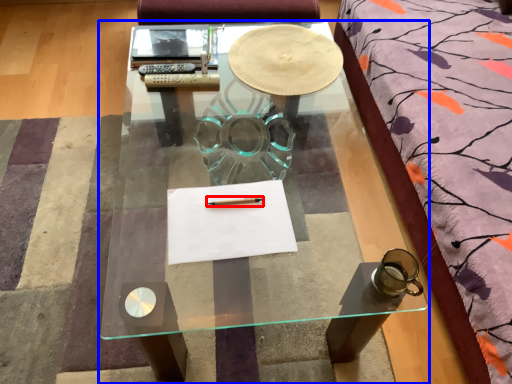
Question: Which of the following is the closest to the observer, pencil (highlighted by a red box) or coffee table (highlighted by a blue box)?

Choices:
 (A) pencil
 (B) coffee table

Answer: (A)